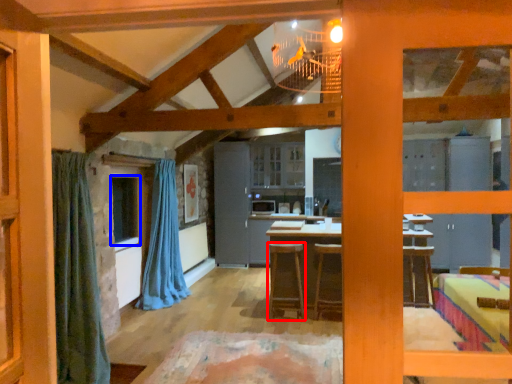
Question: Which object is further to the camera taking this photo, stool (highlighted by a red box) or window (highlighted by a blue box)?

Choices:
 (A) stool
 (B) window

Answer: (A)